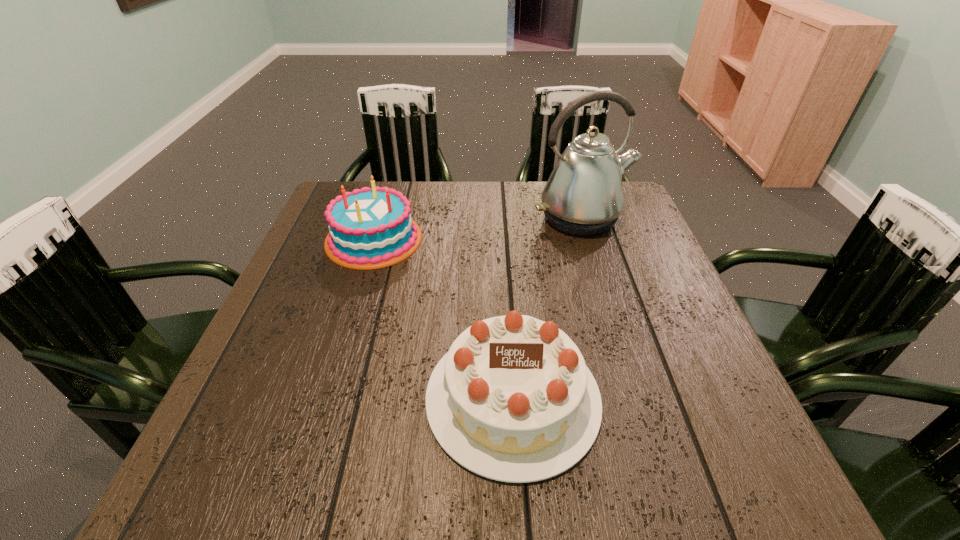
You are a GUI agent. You are given a task and a screenshot of the screen. Output one action in this format:
    pyautogui.click(x=<x>, y=<y>)
    Task: Click on the object that is at the near edge
    
    Given the screenshot: What is the action you would take?
    pyautogui.click(x=512, y=400)

In order to click on object located in the left edge section of the desktop in this screenshot , I will do `click(367, 229)`.

Find the location of `object that is at the right edge`. object that is at the right edge is located at coordinates (583, 196).

Find the location of a particular element. The height and width of the screenshot is (540, 960). object at the far left corner is located at coordinates (367, 229).

This screenshot has width=960, height=540. Find the location of `object that is at the far right corner`. object that is at the far right corner is located at coordinates (583, 196).

Locate an element on the screen. vacant position at the far edge of the desktop is located at coordinates (420, 188).

Where is `vacant space at the near edge of the desktop`? This screenshot has width=960, height=540. vacant space at the near edge of the desktop is located at coordinates (622, 480).

The image size is (960, 540). Identify the location of free spot at the right edge of the desktop. (x=620, y=284).

Image resolution: width=960 pixels, height=540 pixels. I want to click on free location at the far left corner of the desktop, so click(x=351, y=188).

This screenshot has width=960, height=540. Identify the location of vacant space at the far right corner of the desktop. (622, 224).